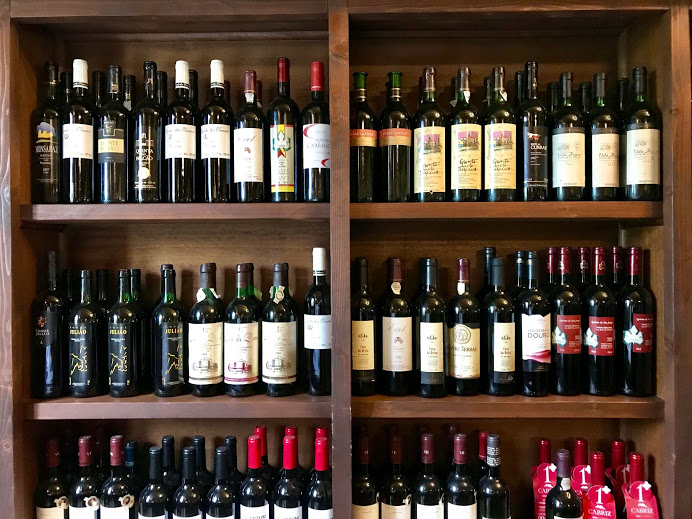
You are a GUI agent. You are given a task and a screenshot of the screen. Output one action in this format:
    pyautogui.click(x=<x>, y=<y>)
    Task: Click on the liquor bottles with light yellowish white labels on the neck and top
    The image size is (692, 519).
    Given the screenshot: What is the action you would take?
    pyautogui.click(x=82, y=71), pyautogui.click(x=183, y=73), pyautogui.click(x=216, y=67), pyautogui.click(x=322, y=263)